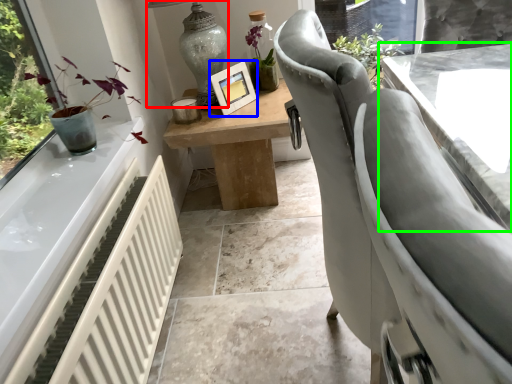
Question: Based on their relative distances, which object is farther from lamp (highlighted by a red box)? Choose from picture frame (highlighted by a blue box) and table (highlighted by a green box).

Choices:
 (A) picture frame
 (B) table

Answer: (B)